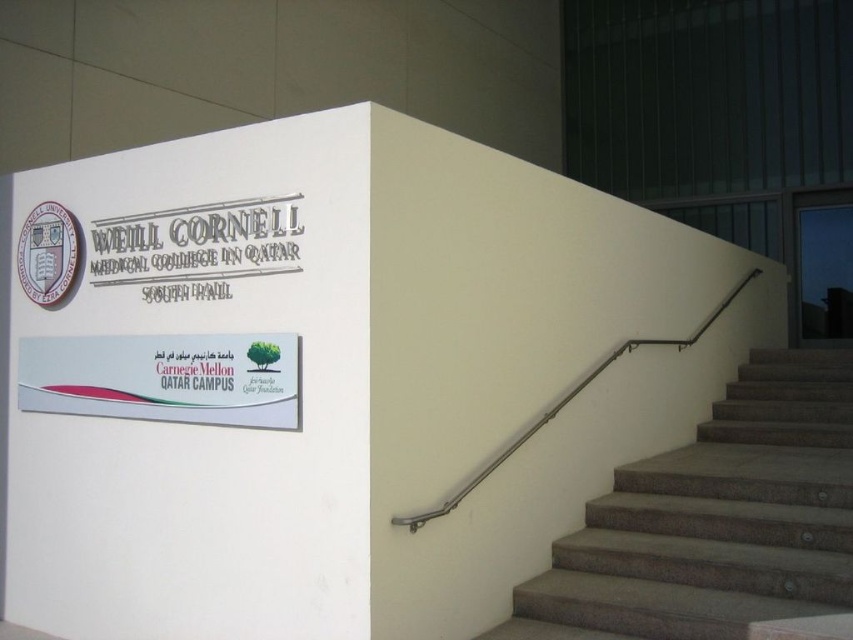
You are standing at the entrance of Weill Cornell Medical College in Qatar South Hall and want to go to the Carnegie Mellon Qatar Campus sign. The Carnegie Mellon Qatar Campus sign is located at point 0.687, 0.769. You see gray textured stairs at right at point (715,520). Can you reach the Carnegie Mellon Qatar Campus sign without going past the gray textured stairs at right?

The Carnegie Mellon Qatar Campus sign is located at point 0.687, 0.769, which is to the left and slightly above the gray textured stairs at right at point (715,520). Therefore, you can reach the Carnegie Mellon Qatar Campus sign without going past the gray textured stairs at right.

You are a person with mobility challenges and need to ascend the stairs. Considering the height of the gray textured stairs at right and the satin silver handrail at right, which one is taller?

The gray textured stairs at right has a greater height compared to the satin silver handrail at right, so the gray textured stairs at right is taller.